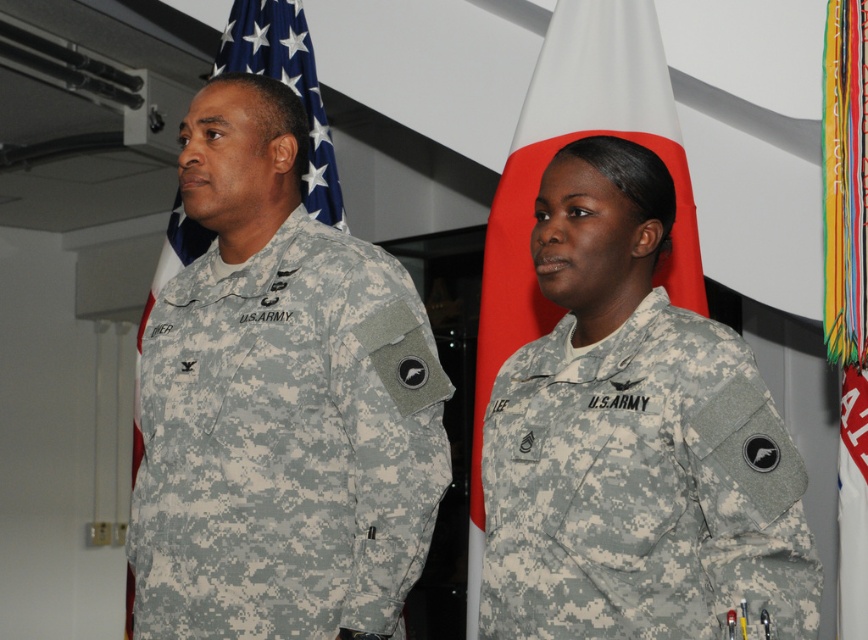
You are a photographer at a military event. You need to adjust the camera settings to capture both the camouflage fabric uniform at left and the camouflage fabric uniform at center clearly. Considering their sizes, which uniform might require a closer focus to ensure sharpness?

The camouflage fabric uniform at left is wider than the camouflage fabric uniform at center, so it might require a closer focus to ensure sharpness.

What are the coordinates of the camouflage fabric uniform at left?

The camouflage fabric uniform at left is located at coordinates point (x=279, y=403).